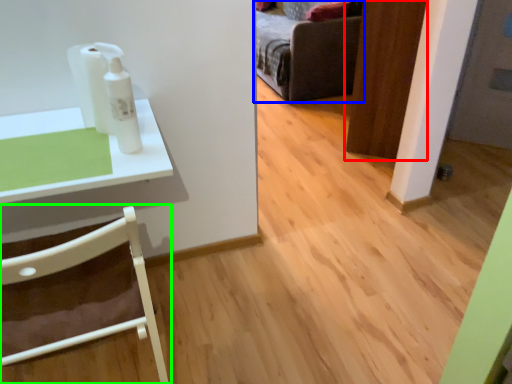
Question: Estimate the real-world distances between objects in this image. Which object is farther from door (highlighted by a red box), furniture (highlighted by a blue box) or chair (highlighted by a green box)?

Choices:
 (A) furniture
 (B) chair

Answer: (B)